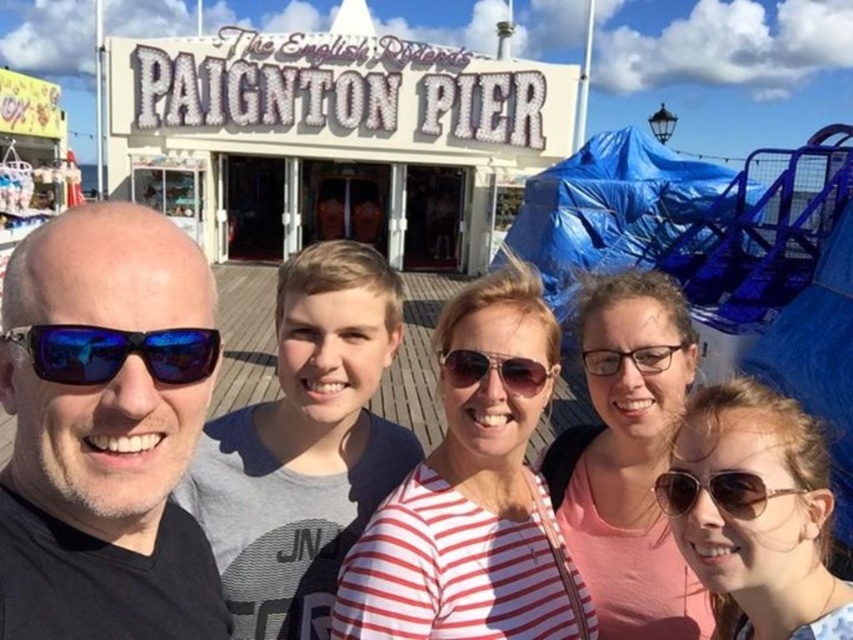
Is point (225, 269) positioned behind point (440, 355)?

Yes, point (225, 269) is farther from viewer.

Which is behind, point (245, 401) or point (520, 356)?

Positioned behind is point (245, 401).

Which is behind, point (386, 384) or point (466, 352)?

The point (386, 384) is more distant.

This screenshot has height=640, width=853. I want to click on striped cotton shirt at center, so click(x=245, y=337).

Describe the element at coordinates (717, 492) in the screenshot. I see `gold metallic sunglasses at lower right` at that location.

Where is `gold metallic sunglasses at lower right`? gold metallic sunglasses at lower right is located at coordinates (717, 492).

Can you confirm if blue reflective lens sunglasses at left is wider than matte black sunglasses at center?

Yes, blue reflective lens sunglasses at left is wider than matte black sunglasses at center.

From the picture: Between blue reflective lens sunglasses at left and matte black sunglasses at center, which one is positioned higher?

blue reflective lens sunglasses at left is higher up.

Who is more distant from viewer, (35, 364) or (527, 376)?

The point (527, 376) is more distant.

This screenshot has width=853, height=640. In order to click on blue reflective lens sunglasses at left in this screenshot , I will do `click(115, 353)`.